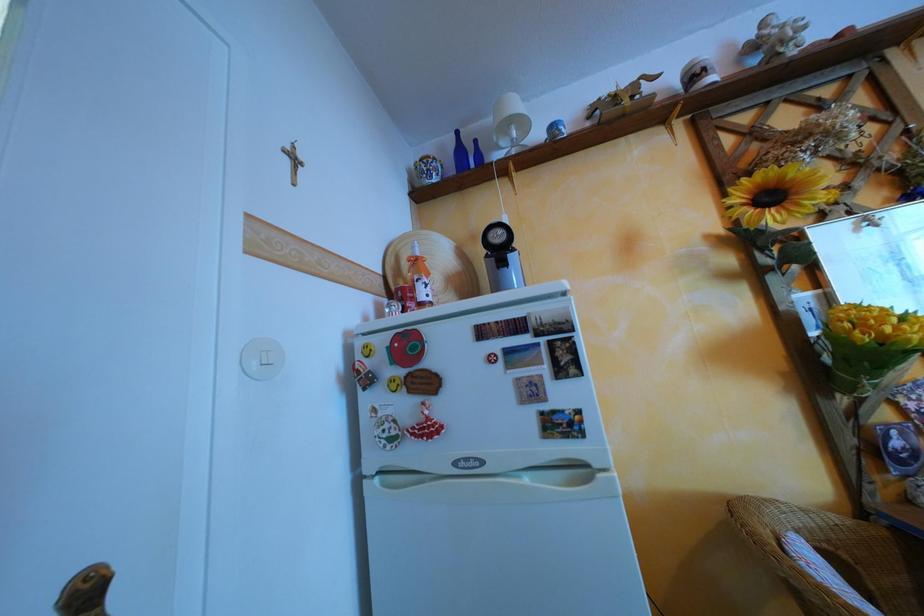
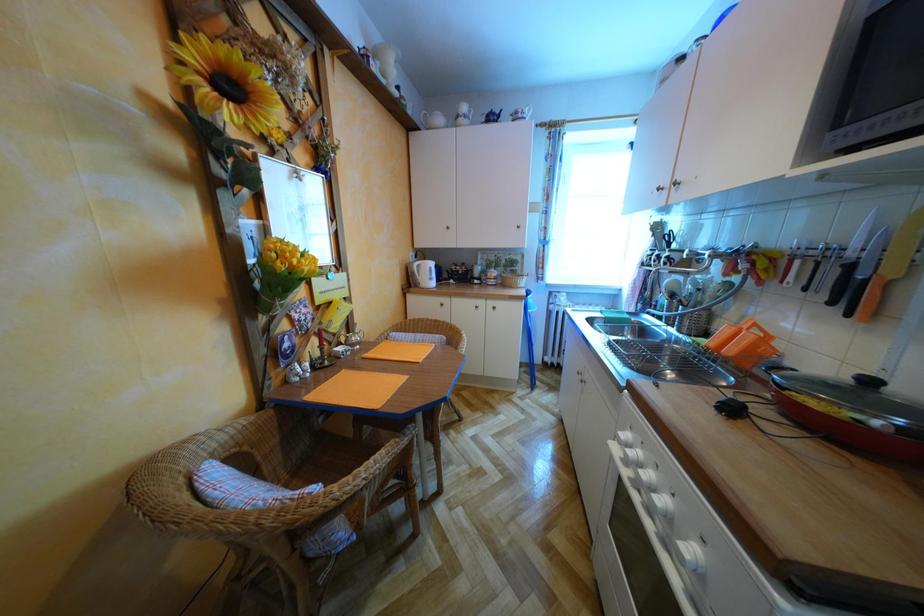
Question: How did the camera likely rotate?

Choices:
 (A) Left
 (B) Right
 (C) Up
 (D) Down

Answer: (B)